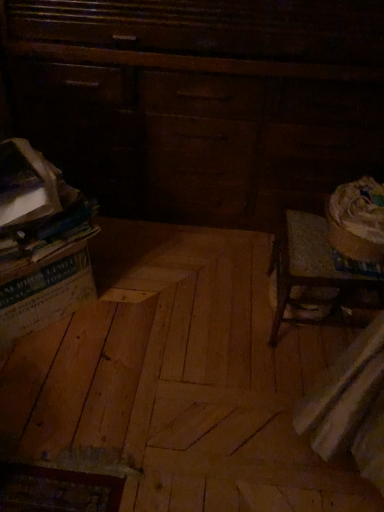
The width and height of the screenshot is (384, 512). What do you see at coordinates (201, 101) in the screenshot?
I see `dark wood dresser at upper left` at bounding box center [201, 101].

At what (x,y) coordinates should I click in order to perform the action: click on dark wood dresser at upper left. Please return your answer as a coordinate pair (x, y). The height and width of the screenshot is (512, 384). Looking at the image, I should click on (201, 101).

This screenshot has width=384, height=512. Describe the element at coordinates (179, 380) in the screenshot. I see `natural wood plywood at center` at that location.

This screenshot has height=512, width=384. I want to click on natural wood plywood at center, so click(x=179, y=380).

What are the coordinates of `dark wood dresser at upper left` in the screenshot? It's located at click(201, 101).

Which is more to the right, dark wood dresser at upper left or natural wood plywood at center?

From the viewer's perspective, dark wood dresser at upper left appears more on the right side.

Between dark wood dresser at upper left and natural wood plywood at center, which one is positioned in front?

natural wood plywood at center is closer to the camera.

Is point (27, 7) farther from viewer compared to point (153, 375)?

Yes, point (27, 7) is farther from viewer.

From the image's perspective, would you say dark wood dresser at upper left is positioned over natural wood plywood at center?

Yes, from the image's perspective, dark wood dresser at upper left is above natural wood plywood at center.

From a real-world perspective, is dark wood dresser at upper left physically above natural wood plywood at center?

Yes.

Considering the sizes of dark wood dresser at upper left and natural wood plywood at center in the image, is dark wood dresser at upper left wider or thinner than natural wood plywood at center?

Considering their sizes, dark wood dresser at upper left looks slimmer than natural wood plywood at center.

Considering the relative sizes of dark wood dresser at upper left and natural wood plywood at center in the image provided, is dark wood dresser at upper left shorter than natural wood plywood at center?

No, dark wood dresser at upper left is not shorter than natural wood plywood at center.

Consider the image. Which of these two, dark wood dresser at upper left or natural wood plywood at center, is bigger?

dark wood dresser at upper left is bigger.

Is dark wood dresser at upper left inside or outside of natural wood plywood at center?

dark wood dresser at upper left lies outside natural wood plywood at center.

Is dark wood dresser at upper left next to natural wood plywood at center and touching it?

They are not placed beside each other.

Is dark wood dresser at upper left aimed at natural wood plywood at center?

Yes.

The height and width of the screenshot is (512, 384). In order to click on plywood on the left side of dark wood dresser at upper left in this screenshot , I will do `click(179, 380)`.

Does natural wood plywood at center appear on the left side of dark wood dresser at upper left?

Correct, you'll find natural wood plywood at center to the left of dark wood dresser at upper left.

Considering the relative positions of natural wood plywood at center and dark wood dresser at upper left in the image provided, is natural wood plywood at center behind dark wood dresser at upper left?

No, natural wood plywood at center is in front of dark wood dresser at upper left.

Is point (263, 318) closer or farther from the camera than point (174, 39)?

Point (263, 318) is farther from the camera than point (174, 39).

From the image's perspective, does natural wood plywood at center appear higher than dark wood dresser at upper left?

Incorrect, from the image's perspective, natural wood plywood at center is lower than dark wood dresser at upper left.

Looking at this image, from a real-world perspective, is natural wood plywood at center above or below dark wood dresser at upper left?

natural wood plywood at center is situated lower than dark wood dresser at upper left in the real world.

Which object is wider, natural wood plywood at center or dark wood dresser at upper left?

natural wood plywood at center is wider.

Which of these two, natural wood plywood at center or dark wood dresser at upper left, stands taller?

dark wood dresser at upper left is taller.

Between natural wood plywood at center and dark wood dresser at upper left, which one has larger size?

dark wood dresser at upper left is bigger.

Is natural wood plywood at center inside or outside of dark wood dresser at upper left?

natural wood plywood at center is not inside dark wood dresser at upper left, it's outside.

Is the surface of natural wood plywood at center in direct contact with dark wood dresser at upper left?

No, natural wood plywood at center is not beside dark wood dresser at upper left.

Is natural wood plywood at center facing towards dark wood dresser at upper left?

No, natural wood plywood at center is not turned towards dark wood dresser at upper left.

What's the angular difference between natural wood plywood at center and dark wood dresser at upper left's facing directions?

90.2 degrees separate the facing orientations of natural wood plywood at center and dark wood dresser at upper left.

The image size is (384, 512). I want to click on plywood located underneath the dark wood dresser at upper left (from a real-world perspective), so click(x=179, y=380).

Image resolution: width=384 pixels, height=512 pixels. Identify the location of furniture lying on the right of natural wood plywood at center. (201, 101).

The height and width of the screenshot is (512, 384). In order to click on furniture lying above the natural wood plywood at center (from the image's perspective) in this screenshot , I will do `click(201, 101)`.